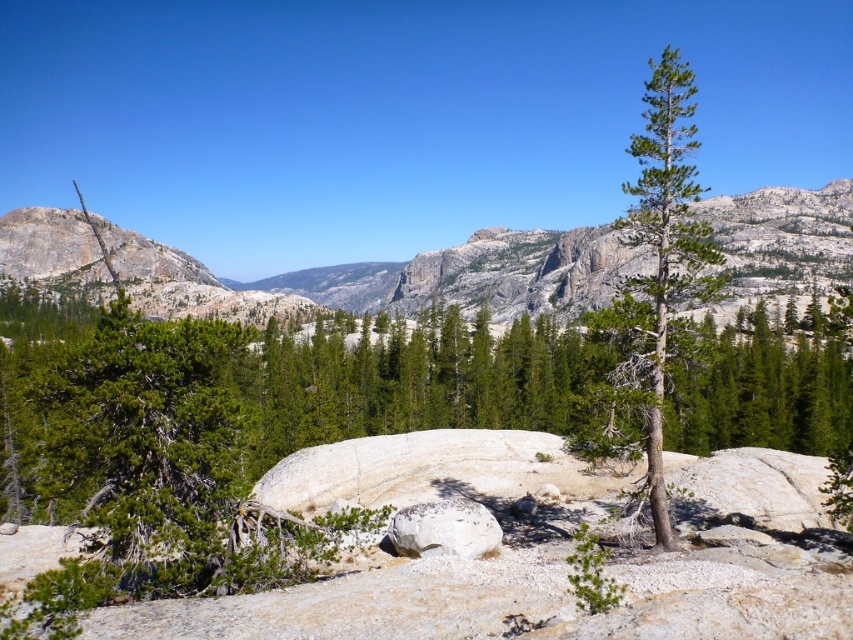
Question: Which point is farther to the camera?

Choices:
 (A) white speckled rock at center
 (B) granite rock formation at center

Answer: (B)

Question: Which object appears farthest from the camera in this image?

Choices:
 (A) white speckled rock at center
 (B) granite rock formation at center
 (C) green textured pine tree at center right

Answer: (B)

Question: Can you confirm if green textured pine tree at center right is bigger than white speckled rock at center?

Choices:
 (A) yes
 (B) no

Answer: (A)

Question: Can you confirm if granite rock formation at center is wider than green textured pine tree at center right?

Choices:
 (A) yes
 (B) no

Answer: (A)

Question: Which point appears farthest from the camera in this image?

Choices:
 (A) (144, 256)
 (B) (654, 332)

Answer: (A)

Question: Does granite rock formation at center lie behind green textured pine tree at center right?

Choices:
 (A) yes
 (B) no

Answer: (A)